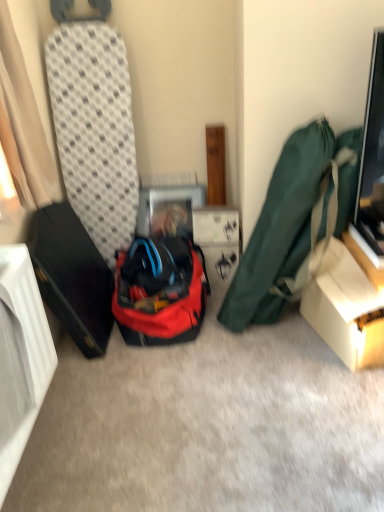
Question: Does red fabric backpack at center have a greater width compared to white cardboard box at center?

Choices:
 (A) no
 (B) yes

Answer: (B)

Question: From a real-world perspective, is red fabric backpack at center on top of white cardboard box at center?

Choices:
 (A) yes
 (B) no

Answer: (A)

Question: Is red fabric backpack at center positioned in front of white cardboard box at center?

Choices:
 (A) yes
 (B) no

Answer: (A)

Question: Considering the relative sizes of red fabric backpack at center and white cardboard box at center in the image provided, is red fabric backpack at center shorter than white cardboard box at center?

Choices:
 (A) no
 (B) yes

Answer: (A)

Question: Can you confirm if red fabric backpack at center is positioned to the right of white cardboard box at center?

Choices:
 (A) yes
 (B) no

Answer: (B)

Question: From a real-world perspective, is green fabric bag at right positioned above or below matte cardboard box at lower right?

Choices:
 (A) below
 (B) above

Answer: (B)

Question: From their relative heights in the image, would you say green fabric bag at right is taller or shorter than matte cardboard box at lower right?

Choices:
 (A) short
 (B) tall

Answer: (B)

Question: Would you say green fabric bag at right is inside or outside matte cardboard box at lower right?

Choices:
 (A) outside
 (B) inside

Answer: (A)

Question: In terms of size, does green fabric bag at right appear bigger or smaller than matte cardboard box at lower right?

Choices:
 (A) small
 (B) big

Answer: (B)

Question: In the image, is white cardboard box at center on the left side or the right side of red fabric backpack at center?

Choices:
 (A) right
 (B) left

Answer: (A)

Question: From the image's perspective, relative to red fabric backpack at center, is white cardboard box at center above or below?

Choices:
 (A) above
 (B) below

Answer: (A)

Question: From a real-world perspective, relative to red fabric backpack at center, is white cardboard box at center vertically above or below?

Choices:
 (A) below
 (B) above

Answer: (A)

Question: Considering their positions, is white cardboard box at center located in front of or behind red fabric backpack at center?

Choices:
 (A) front
 (B) behind

Answer: (B)

Question: In terms of size, does red fabric backpack at center appear bigger or smaller than white cardboard box at center?

Choices:
 (A) big
 (B) small

Answer: (A)

Question: Is point click(x=201, y=261) closer or farther from the camera than point click(x=221, y=222)?

Choices:
 (A) farther
 (B) closer

Answer: (A)